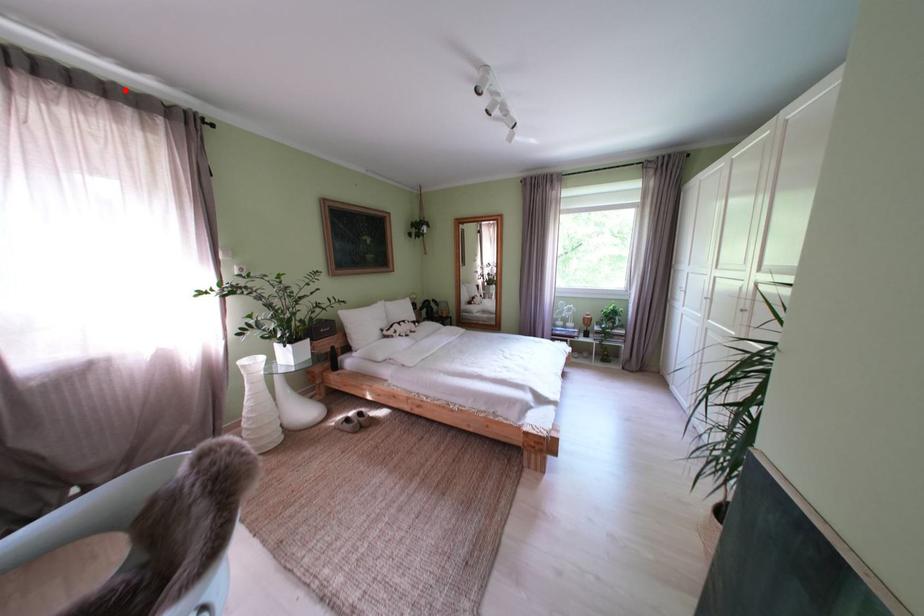
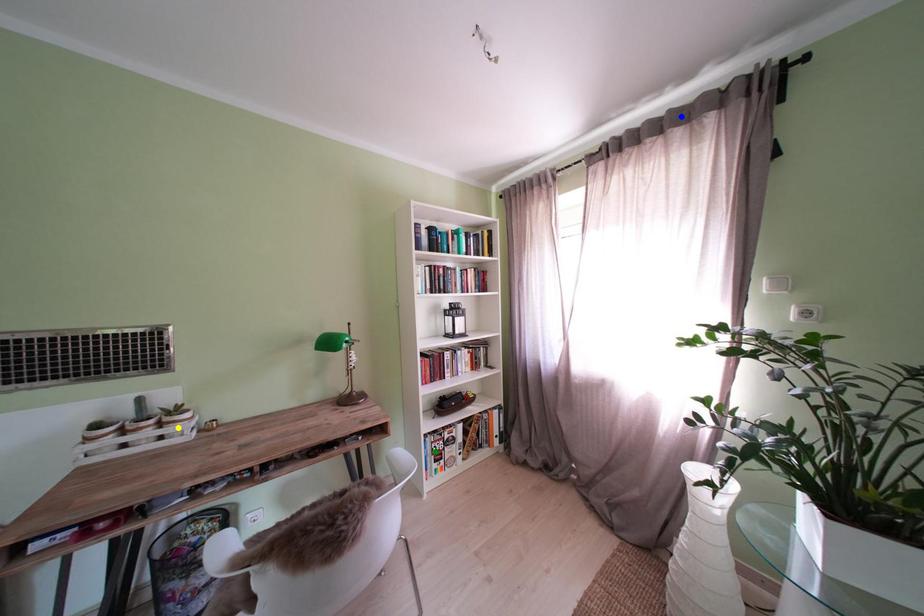
Question: I am providing you with two images of the same scene from different viewpoints. A red point is marked on the first image. You are given multiple points on the second image. In image 2, which mark is for the same physical point as the one in image 1?

Choices:
 (A) green point
 (B) yellow point
 (C) blue point

Answer: (C)